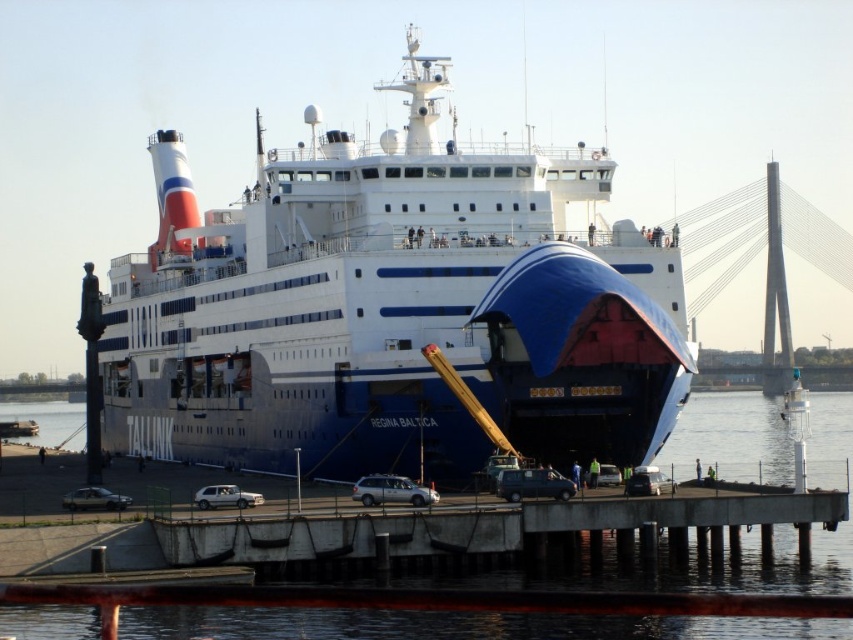
Question: Is metallic blue van at lower center in front of silver metallic sedan at lower left?

Choices:
 (A) no
 (B) yes

Answer: (B)

Question: Where is concrete at center located in relation to metallic blue van at lower center in the image?

Choices:
 (A) below
 (B) above

Answer: (A)

Question: Is concrete at center thinner than metallic silver car at lower center?

Choices:
 (A) no
 (B) yes

Answer: (A)

Question: Which point appears closest to the camera in this image?

Choices:
 (A) (550, 476)
 (B) (175, 234)
 (C) (128, 500)

Answer: (A)

Question: Estimate the real-world distances between objects in this image. Which object is farther from the metallic silver car at lower center?

Choices:
 (A) blue glossy water at lower center
 (B) concrete at center
 (C) satin silver suv at center

Answer: (A)

Question: Which is farther from the blue glossy water at lower center?

Choices:
 (A) concrete at center
 (B) metallic silver car at lower center

Answer: (B)